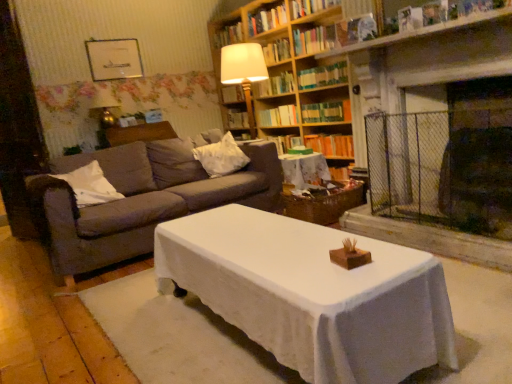
Question: Are hardcover book at center, positioned as the 4th book in bottom-to-top order, and white soft pillow at left, positioned as the second pillow in back-to-front order, beside each other?

Choices:
 (A) yes
 (B) no

Answer: (B)

Question: Is hardcover book at center, positioned as the 4th book in bottom-to-top order, facing away from white soft pillow at left, positioned as the second pillow in back-to-front order?

Choices:
 (A) no
 (B) yes

Answer: (A)

Question: From the image's perspective, is hardcover book at center, positioned as the 4th book in bottom-to-top order, beneath white soft pillow at left, the first pillow in the front-to-back sequence?

Choices:
 (A) no
 (B) yes

Answer: (A)

Question: Does hardcover book at center, the 7th book positioned from the top, come in front of white soft pillow at left, which ranks as the second pillow in right-to-left order?

Choices:
 (A) yes
 (B) no

Answer: (B)

Question: Would you say white soft pillow at left, positioned as the second pillow in back-to-front order, is to the left or to the right of hardcover book at center, positioned as the 4th book in bottom-to-top order, in the picture?

Choices:
 (A) right
 (B) left

Answer: (B)

Question: From a real-world perspective, is white soft pillow at left, acting as the first pillow starting from the left, positioned above or below hardcover book at center, positioned as the 4th book in bottom-to-top order?

Choices:
 (A) above
 (B) below

Answer: (B)

Question: Considering the positions of point (79, 170) and point (284, 107), is point (79, 170) closer or farther from the camera than point (284, 107)?

Choices:
 (A) closer
 (B) farther

Answer: (A)

Question: In terms of height, does white soft pillow at left, which ranks as the second pillow in right-to-left order, look taller or shorter compared to hardcover book at center, the 7th book positioned from the top?

Choices:
 (A) short
 (B) tall

Answer: (B)

Question: Considering the positions of point (240, 21) and point (297, 36), is point (240, 21) closer or farther from the camera than point (297, 36)?

Choices:
 (A) farther
 (B) closer

Answer: (A)

Question: From the image's perspective, is hardcover book at upper center, the 1th book from the top, located above or below hardcover book at upper center, positioned as the 4th book in top-to-bottom order?

Choices:
 (A) above
 (B) below

Answer: (A)

Question: From a real-world perspective, is hardcover book at upper center, the 10th book positioned from the bottom, physically located above or below hardcover book at upper center, positioned as the 4th book in top-to-bottom order?

Choices:
 (A) above
 (B) below

Answer: (A)

Question: Relative to hardcover book at upper center, positioned as the 4th book in top-to-bottom order, is hardcover book at upper center, the 1th book from the top, in front or behind?

Choices:
 (A) behind
 (B) front

Answer: (A)

Question: Relative to dark gray fabric couch at left, is white soft pillow at left, the first pillow in the front-to-back sequence, in front or behind?

Choices:
 (A) front
 (B) behind

Answer: (B)

Question: Would you say white soft pillow at left, positioned as the second pillow in back-to-front order, is to the left or to the right of dark gray fabric couch at left in the picture?

Choices:
 (A) right
 (B) left

Answer: (B)